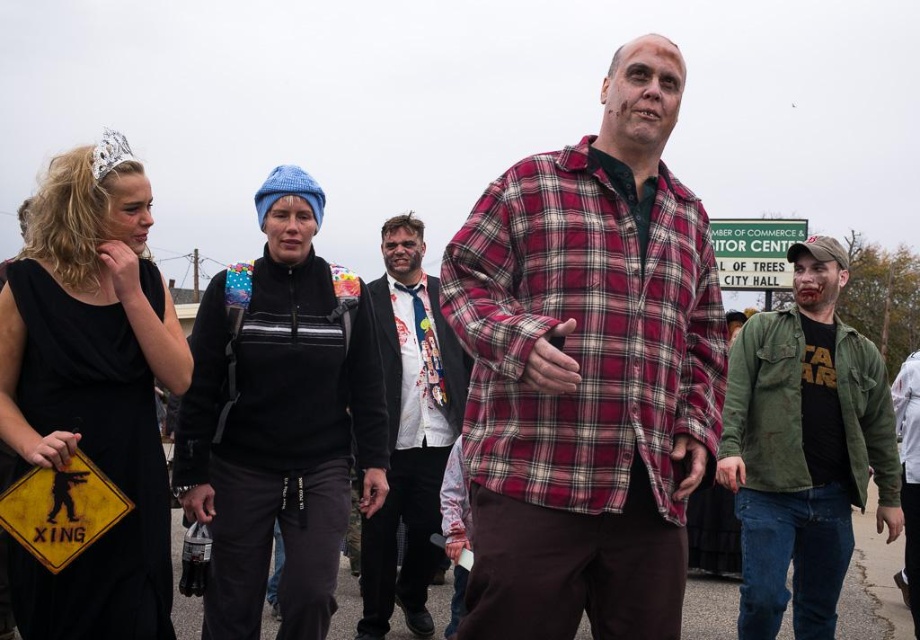
Does black satin dress at left have a lesser height compared to green textured jacket at right?

No, black satin dress at left is not shorter than green textured jacket at right.

Is black satin dress at left above green textured jacket at right?

Correct, black satin dress at left is located above green textured jacket at right.

Who is more forward, (58, 355) or (734, 392)?

Point (58, 355)

The width and height of the screenshot is (920, 640). In order to click on black satin dress at left in this screenshot , I will do `click(92, 388)`.

This screenshot has width=920, height=640. I want to click on black fleece jacket at center, so click(279, 419).

Is black fleece jacket at center below white shirt with tie at center?

No, black fleece jacket at center is not below white shirt with tie at center.

Between point (197, 406) and point (391, 532), which one is positioned in front?

Point (197, 406) is more forward.

The width and height of the screenshot is (920, 640). I want to click on black fleece jacket at center, so click(x=279, y=419).

Does white printed shirt at center appear on the right side of green plastic sign at upper center?

Incorrect, white printed shirt at center is not on the right side of green plastic sign at upper center.

Which of these two, white printed shirt at center or green plastic sign at upper center, stands shorter?

green plastic sign at upper center is shorter.

What do you see at coordinates (420, 362) in the screenshot? I see `white printed shirt at center` at bounding box center [420, 362].

Image resolution: width=920 pixels, height=640 pixels. What are the coordinates of `white printed shirt at center` in the screenshot? It's located at (420, 362).